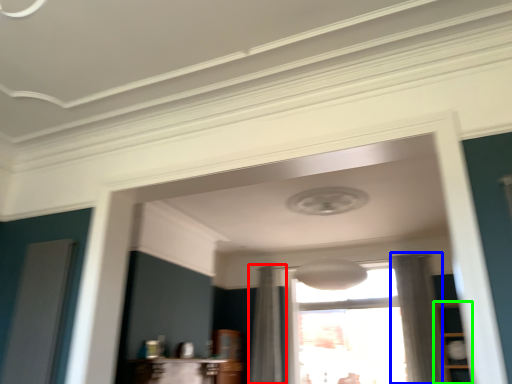
Question: Which object is positioned closest to curtain (highlighted by a red box)? Select from curtain (highlighted by a blue box) and cabinetry (highlighted by a green box).

Choices:
 (A) curtain
 (B) cabinetry

Answer: (A)